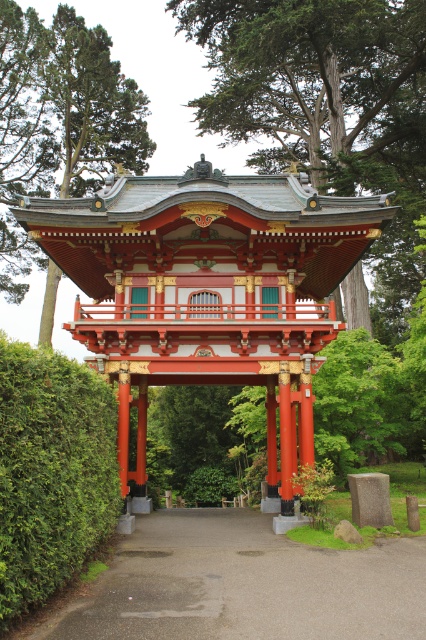
Can you confirm if shiny lacquered wood pagoda at center is smaller than green leafy hedge at left?

No.

Locate an element on the screen. This screenshot has height=640, width=426. shiny lacquered wood pagoda at center is located at coordinates (209, 289).

I want to click on shiny lacquered wood pagoda at center, so click(209, 289).

Is point (195, 340) less distant than point (316, 168)?

That is True.

Who is lower down, shiny lacquered wood pagoda at center or green textured tree at center?

Positioned lower is shiny lacquered wood pagoda at center.

Describe the element at coordinates (209, 289) in the screenshot. This screenshot has width=426, height=640. I see `shiny lacquered wood pagoda at center` at that location.

You are a GUI agent. You are given a task and a screenshot of the screen. Output one action in this format:
    pyautogui.click(x=<x>, y=<y>)
    Task: Click on the shiny lacquered wood pagoda at center
    This screenshot has width=426, height=640.
    Given the screenshot: What is the action you would take?
    pyautogui.click(x=209, y=289)

Between shiny lacquered wood pagoda at center and green textured tree at upper center, which one is positioned higher?

green textured tree at upper center is higher up.

Can you confirm if shiny lacquered wood pagoda at center is positioned below green textured tree at upper center?

Yes, shiny lacquered wood pagoda at center is below green textured tree at upper center.

In the scene shown: Measure the distance between point (160, 307) and camera.

Point (160, 307) and camera are 16.32 meters apart.

Image resolution: width=426 pixels, height=640 pixels. Identify the location of shiny lacquered wood pagoda at center. (209, 289).